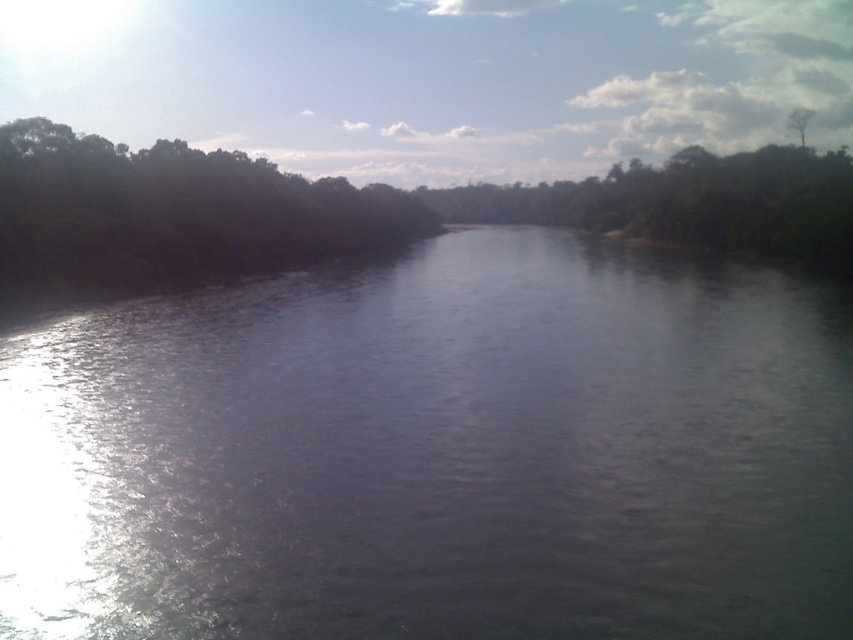
Question: Which point appears closest to the camera in this image?

Choices:
 (A) (300, 182)
 (B) (798, 131)

Answer: (A)

Question: Which object is the farthest from the green leafy tree at upper right?

Choices:
 (A) shiny dark water at center
 (B) dark green leafy trees at left

Answer: (A)

Question: Which object is the closest to the shiny dark water at center?

Choices:
 (A) green leafy tree at upper right
 (B) dark green leafy trees at left

Answer: (B)

Question: Does dark green leafy trees at left have a smaller size compared to green leafy tree at upper right?

Choices:
 (A) yes
 (B) no

Answer: (B)

Question: Is shiny dark water at center smaller than green leafy tree at upper right?

Choices:
 (A) no
 (B) yes

Answer: (A)

Question: Is shiny dark water at center above green leafy tree at upper right?

Choices:
 (A) yes
 (B) no

Answer: (B)